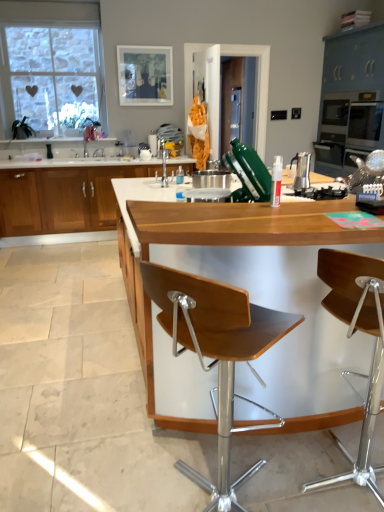
The image size is (384, 512). Identify the location of clear glass window at upper left. (45, 26).

This screenshot has height=512, width=384. Find the location of `wooden seat at center, the 1th chair in the right-to-left sequence`. wooden seat at center, the 1th chair in the right-to-left sequence is located at coordinates (350, 336).

In order to face white matte picture frame at upper center, should I rotate leftwards or rightwards?

You should rotate left by 6.316 degrees.

What do you see at coordinates (62, 198) in the screenshot? I see `wooden cabinet at left, placed as the 2th cabinetry when sorted from right to left` at bounding box center [62, 198].

The image size is (384, 512). What do you see at coordinates (351, 99) in the screenshot?
I see `matte gray cabinetry at upper right, the second cabinetry in the left-to-right sequence` at bounding box center [351, 99].

This screenshot has height=512, width=384. I want to click on wooden at center, the second countertop in the top-to-bottom sequence, so click(x=250, y=300).

The height and width of the screenshot is (512, 384). I want to click on wooden seat at center, arranged as the first chair when viewed from the left, so click(217, 353).

Can you confirm if satin silver espresso maker at center is positioned to the left of matte gray cabinetry at upper right, the second cabinetry in the left-to-right sequence?

Correct, you'll find satin silver espresso maker at center to the left of matte gray cabinetry at upper right, the second cabinetry in the left-to-right sequence.

Consider the image. Is satin silver espresso maker at center taller or shorter than matte gray cabinetry at upper right, which is counted as the 1th cabinetry, starting from the right?

satin silver espresso maker at center is shorter than matte gray cabinetry at upper right, which is counted as the 1th cabinetry, starting from the right.

Is wooden seat at center, acting as the 2th chair starting from the right, aimed at wooden cabinet at left, placed as the 2th cabinetry when sorted from right to left?

No.

From a real-world perspective, is wooden seat at center, arranged as the first chair when viewed from the left, positioned above or below wooden cabinet at left, placed as the 2th cabinetry when sorted from right to left?

In terms of real-world spatial position, wooden seat at center, arranged as the first chair when viewed from the left, is above wooden cabinet at left, placed as the 2th cabinetry when sorted from right to left.

The width and height of the screenshot is (384, 512). Identify the location of cabinetry located on the left of wooden seat at center, arranged as the first chair when viewed from the left. (62, 198).

From the image's perspective, is wooden seat at center, acting as the 2th chair starting from the right, above or below wooden cabinet at left, placed as the 2th cabinetry when sorted from right to left?

From the image's perspective, wooden seat at center, acting as the 2th chair starting from the right, appears below wooden cabinet at left, placed as the 2th cabinetry when sorted from right to left.

Consider the image. Is matte gray cabinetry at upper right, which is counted as the 1th cabinetry, starting from the right, spatially inside white matte picture frame at upper center, or outside of it?

matte gray cabinetry at upper right, which is counted as the 1th cabinetry, starting from the right, is not enclosed by white matte picture frame at upper center.

In the scene shown: From the image's perspective, would you say matte gray cabinetry at upper right, the second cabinetry in the left-to-right sequence, is shown under white matte picture frame at upper center?

Correct, matte gray cabinetry at upper right, the second cabinetry in the left-to-right sequence, appears lower than white matte picture frame at upper center in the image.

In the image, is matte gray cabinetry at upper right, the second cabinetry in the left-to-right sequence, positioned in front of or behind white matte picture frame at upper center?

Visually, matte gray cabinetry at upper right, the second cabinetry in the left-to-right sequence, is located in front of white matte picture frame at upper center.

Visually, is wooden cabinet at left, arranged as the 1th cabinetry when viewed from the left, positioned to the left or to the right of clear glass window at upper left?

wooden cabinet at left, arranged as the 1th cabinetry when viewed from the left, is to the right of clear glass window at upper left.

From the picture: Is wooden cabinet at left, arranged as the 1th cabinetry when viewed from the left, outside of clear glass window at upper left?

Yes, wooden cabinet at left, arranged as the 1th cabinetry when viewed from the left, is not within clear glass window at upper left.

In the scene shown: Does wooden cabinet at left, placed as the 2th cabinetry when sorted from right to left, touch clear glass window at upper left?

They are not placed beside each other.

Is white matte picture frame at upper center inside the boundaries of satin silver espresso maker at center, or outside?

white matte picture frame at upper center exists outside the volume of satin silver espresso maker at center.

Is white matte picture frame at upper center turned away from satin silver espresso maker at center?

That's not correct — white matte picture frame at upper center is not looking away from satin silver espresso maker at center.

Does white matte picture frame at upper center have a greater width compared to satin silver espresso maker at center?

No.

How many degrees apart are the facing directions of satin silver espresso maker at center and wooden cabinet at left, placed as the 2th cabinetry when sorted from right to left?

The angular difference between satin silver espresso maker at center and wooden cabinet at left, placed as the 2th cabinetry when sorted from right to left, is 92.9 degrees.

Which is more to the right, satin silver espresso maker at center or wooden cabinet at left, arranged as the 1th cabinetry when viewed from the left?

satin silver espresso maker at center is more to the right.

Does satin silver espresso maker at center have a smaller size compared to wooden cabinet at left, placed as the 2th cabinetry when sorted from right to left?

Yes.

Is wooden seat at center, the 1th chair in the right-to-left sequence, wider or thinner than matte gray cabinetry at upper right, which is counted as the 1th cabinetry, starting from the right?

wooden seat at center, the 1th chair in the right-to-left sequence, is thinner than matte gray cabinetry at upper right, which is counted as the 1th cabinetry, starting from the right.

Do you think wooden seat at center, the 1th chair in the right-to-left sequence, is within matte gray cabinetry at upper right, the second cabinetry in the left-to-right sequence, or outside of it?

The correct answer is: outside.

Does wooden seat at center, the 1th chair in the right-to-left sequence, turn towards matte gray cabinetry at upper right, the second cabinetry in the left-to-right sequence?

No, wooden seat at center, the 1th chair in the right-to-left sequence, is not turned towards matte gray cabinetry at upper right, the second cabinetry in the left-to-right sequence.

Looking at this image, from the image's perspective, is wooden seat at center, the 2th chair when ordered from left to right, on top of matte gray cabinetry at upper right, which is counted as the 1th cabinetry, starting from the right?

No, from the image's perspective, wooden seat at center, the 2th chair when ordered from left to right, is not over matte gray cabinetry at upper right, which is counted as the 1th cabinetry, starting from the right.

At what (x,y) coordinates should I click in order to perform the action: click on appliance in front of the matte gray cabinetry at upper right, the second cabinetry in the left-to-right sequence. Please return your answer as a coordinate pair (x, y). Looking at the image, I should click on (301, 170).

The height and width of the screenshot is (512, 384). I want to click on cabinetry that is on the left side of wooden seat at center, arranged as the first chair when viewed from the left, so click(62, 198).

Estimate the real-world distances between objects in this image. Which object is closer to white matte picture frame at upper center, matte gray cabinetry at upper right, which is counted as the 1th cabinetry, starting from the right, or wooden seat at center, the 1th chair in the right-to-left sequence?

Based on the image, matte gray cabinetry at upper right, which is counted as the 1th cabinetry, starting from the right, appears to be nearer to white matte picture frame at upper center.

From the image, which object appears to be farther from white matte picture frame at upper center, wooden seat at center, the 1th chair in the right-to-left sequence, or wooden cabinet at left, placed as the 2th cabinetry when sorted from right to left?

wooden seat at center, the 1th chair in the right-to-left sequence.

Estimate the real-world distances between objects in this image. Which object is further from wooden cabinet at left, placed as the 2th cabinetry when sorted from right to left, matte gray cabinetry at upper right, which is counted as the 1th cabinetry, starting from the right, or wooden at center, the second countertop viewed from the back?

matte gray cabinetry at upper right, which is counted as the 1th cabinetry, starting from the right, is positioned further to the anchor wooden cabinet at left, placed as the 2th cabinetry when sorted from right to left.

Looking at the image, which one is located further to clear glass window at upper left, white glossy countertop at center, which appears as the first countertop when viewed from the top, or wooden seat at center, the 2th chair when ordered from left to right?

Among the two, wooden seat at center, the 2th chair when ordered from left to right, is located further to clear glass window at upper left.

Considering their positions, is wooden seat at center, arranged as the first chair when viewed from the left, positioned closer to wooden seat at center, the 2th chair when ordered from left to right, than clear glass window at upper left?

Based on the image, wooden seat at center, arranged as the first chair when viewed from the left, appears to be nearer to wooden seat at center, the 2th chair when ordered from left to right.

From the picture: Estimate the real-world distances between objects in this image. Which object is closer to wooden cabinet at left, placed as the 2th cabinetry when sorted from right to left, white matte picture frame at upper center or matte gray cabinetry at upper right, which is counted as the 1th cabinetry, starting from the right?

The object closer to wooden cabinet at left, placed as the 2th cabinetry when sorted from right to left, is white matte picture frame at upper center.

Estimate the real-world distances between objects in this image. Which object is closer to clear glass window at upper left, wooden cabinet at left, placed as the 2th cabinetry when sorted from right to left, or white glossy countertop at center, which ranks as the second countertop in bottom-to-top order?

Based on the image, white glossy countertop at center, which ranks as the second countertop in bottom-to-top order, appears to be nearer to clear glass window at upper left.

When comparing their distances from matte gray cabinetry at upper right, which is counted as the 1th cabinetry, starting from the right, does white matte picture frame at upper center or white glossy countertop at center, which appears as the first countertop when viewed from the top, seem further?

white glossy countertop at center, which appears as the first countertop when viewed from the top, is positioned further to the anchor matte gray cabinetry at upper right, which is counted as the 1th cabinetry, starting from the right.

The width and height of the screenshot is (384, 512). Identify the location of chair between wooden seat at center, acting as the 2th chair starting from the right, and matte gray cabinetry at upper right, which is counted as the 1th cabinetry, starting from the right, from front to back. (350, 336).

The height and width of the screenshot is (512, 384). In order to click on appliance between wooden seat at center, acting as the 2th chair starting from the right, and matte gray cabinetry at upper right, which is counted as the 1th cabinetry, starting from the right, along the z-axis in this screenshot , I will do `click(301, 170)`.

I want to click on countertop between wooden seat at center, the 2th chair when ordered from left to right, and white glossy countertop at center, which appears as the first countertop when viewed from the top, along the z-axis, so click(x=250, y=300).

Identify the location of chair located between wooden seat at center, acting as the 2th chair starting from the right, and wooden cabinet at left, arranged as the 1th cabinetry when viewed from the left, in the depth direction. (350, 336).